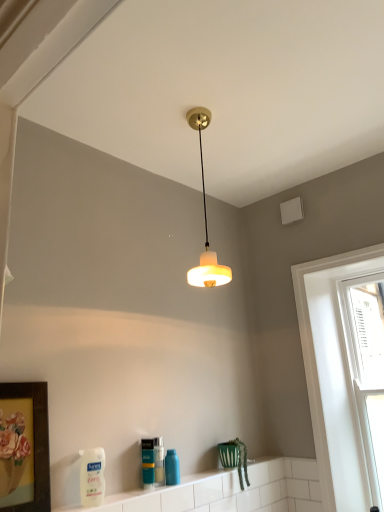
The image size is (384, 512). Identify the location of wooden framed artwork at lower left. 24,447.

Describe the element at coordinates (159, 461) in the screenshot. The width and height of the screenshot is (384, 512). I see `translucent plastic bottle at lower center` at that location.

Describe the element at coordinates (172, 468) in the screenshot. The width and height of the screenshot is (384, 512). I see `blue glossy bottle at lower center, positioned as the first cleaning product in back-to-front order` at that location.

Describe the element at coordinates (232, 490) in the screenshot. I see `white glossy tile at lower center` at that location.

At what (x,y) coordinates should I click in order to perform the action: click on white glossy tile at lower center. Please return your answer as a coordinate pair (x, y). The image size is (384, 512). Looking at the image, I should click on (232, 490).

Identify the location of white matte bottle at lower left, arranged as the first cleaning product when viewed from the left. The height and width of the screenshot is (512, 384). (92, 476).

Does wooden framed artwork at lower left turn towards white matte bottle at lower left, arranged as the first cleaning product when viewed from the left?

No, wooden framed artwork at lower left is not oriented towards white matte bottle at lower left, arranged as the first cleaning product when viewed from the left.

Where is `picture frame that appears in front of the white matte bottle at lower left, arranged as the first cleaning product when viewed from the left`? This screenshot has width=384, height=512. picture frame that appears in front of the white matte bottle at lower left, arranged as the first cleaning product when viewed from the left is located at coordinates (24, 447).

Does wooden framed artwork at lower left have a lesser width compared to white matte bottle at lower left, acting as the 2th cleaning product starting from the right?

Incorrect, the width of wooden framed artwork at lower left is not less than that of white matte bottle at lower left, acting as the 2th cleaning product starting from the right.

Would you say wooden framed artwork at lower left is a long distance from white matte bottle at lower left, arranged as the second cleaning product when viewed from the back?

wooden framed artwork at lower left is actually quite close to white matte bottle at lower left, arranged as the second cleaning product when viewed from the back.

Looking at this image, which object is closer to the camera taking this photo, white glossy tile at lower center or white glass window at right, the 1th window from the right?

white glossy tile at lower center is in front.

Between white glossy tile at lower center and white glass window at right, the 2th window from the left, which one has larger width?

white glossy tile at lower center.

Measure the distance from white glossy tile at lower center to white glass window at right, the 2th window from the left.

They are 29.18 inches apart.

Considering the sizes of white glossy tile at lower center and white glass window at right, the 1th window from the right, in the image, is white glossy tile at lower center taller or shorter than white glass window at right, the 1th window from the right,?

white glossy tile at lower center is shorter than white glass window at right, the 1th window from the right.

Considering the relative sizes of white glossy tile at lower center and white matte bottle at lower left, arranged as the second cleaning product when viewed from the back, in the image provided, is white glossy tile at lower center taller than white matte bottle at lower left, arranged as the second cleaning product when viewed from the back,?

Incorrect, the height of white glossy tile at lower center is not larger of that of white matte bottle at lower left, arranged as the second cleaning product when viewed from the back.

Is white matte bottle at lower left, which appears as the first cleaning product when viewed from the front, located within white glossy tile at lower center?

No, white matte bottle at lower left, which appears as the first cleaning product when viewed from the front, is not inside white glossy tile at lower center.

Which object is thinner, white glossy tile at lower center or white matte bottle at lower left, which appears as the first cleaning product when viewed from the front?

white matte bottle at lower left, which appears as the first cleaning product when viewed from the front.

Find the location of a particular element. Image resolution: width=384 pixels, height=512 pixels. toiletry on the left of the white glossy tile at lower center is located at coordinates (159, 461).

Is translucent plastic bottle at lower center bigger than white glossy tile at lower center?

No.

Would you say translucent plastic bottle at lower center is to the left or to the right of white glossy tile at lower center in the picture?

translucent plastic bottle at lower center is positioned on white glossy tile at lower center's left side.

Consider the image. Is translucent plastic bottle at lower center turned away from white glossy tile at lower center?

No, translucent plastic bottle at lower center's orientation is not away from white glossy tile at lower center.

Is wooden framed artwork at lower left taller or shorter than white glossy tile at lower center?

Considering their sizes, wooden framed artwork at lower left has more height than white glossy tile at lower center.

How many degrees apart are the facing directions of wooden framed artwork at lower left and white glossy tile at lower center?

wooden framed artwork at lower left and white glossy tile at lower center are facing 0.58 degrees away from each other.

Identify the location of picture frame on the left of white glossy tile at lower center. This screenshot has width=384, height=512. (24, 447).

Can you confirm if wooden framed artwork at lower left is positioned to the left of white glossy tile at lower center?

Yes, wooden framed artwork at lower left is to the left of white glossy tile at lower center.

Is white glossy window at right, the 1th window from the left, smaller than wooden framed artwork at lower left?

No, white glossy window at right, the 1th window from the left, is not smaller than wooden framed artwork at lower left.

Between white glossy window at right, the 1th window from the left, and wooden framed artwork at lower left, which one appears on the left side from the viewer's perspective?

From the viewer's perspective, wooden framed artwork at lower left appears more on the left side.

The width and height of the screenshot is (384, 512). In the image, there is a white glossy window at right, the 1th window from the left. In order to click on picture frame below it (from the image's perspective) in this screenshot , I will do `click(24, 447)`.

In the scene shown: Who is shorter, white glossy window at right, the 1th window from the left, or wooden framed artwork at lower left?

wooden framed artwork at lower left.

From the image's perspective, which one is positioned higher, white glossy window at right, the 2th window from the right, or translucent glass lampshade at upper center?

From the image's view, translucent glass lampshade at upper center is above.

Is white glossy window at right, the 2th window from the right, further to the viewer compared to translucent glass lampshade at upper center?

Yes.

Considering the sizes of white glossy window at right, the 1th window from the left, and translucent glass lampshade at upper center in the image, is white glossy window at right, the 1th window from the left, bigger or smaller than translucent glass lampshade at upper center?

white glossy window at right, the 1th window from the left, is bigger than translucent glass lampshade at upper center.

Could you tell me if white glossy window at right, the 1th window from the left, is facing translucent glass lampshade at upper center?

Yes, white glossy window at right, the 1th window from the left, is turned towards translucent glass lampshade at upper center.

You are a GUI agent. You are given a task and a screenshot of the screen. Output one action in this format:
    pyautogui.click(x=<x>, y=<y>)
    Task: Click on the picture frame above the white matte bottle at lower left, acting as the 2th cleaning product starting from the right (from the image's perspective)
    This screenshot has width=384, height=512.
    Given the screenshot: What is the action you would take?
    pyautogui.click(x=24, y=447)

This screenshot has height=512, width=384. I want to click on the 1st window positioned above the white glossy tile at lower center (from a real-world perspective), so click(x=366, y=368).

Considering their positions, is translucent plastic bottle at lower center positioned further to blue glossy bottle at lower center, the 2th cleaning product from the front, than white glass window at right, the 2th window from the left?

white glass window at right, the 2th window from the left, lies further to blue glossy bottle at lower center, the 2th cleaning product from the front, than the other object.

When comparing their distances from wooden framed artwork at lower left, does white glossy window at right, the 1th window from the left, or translucent plastic bottle at lower center seem further?

Based on the image, white glossy window at right, the 1th window from the left, appears to be further to wooden framed artwork at lower left.

From the image, which object appears to be farther from translucent glass lampshade at upper center, wooden framed artwork at lower left or white glossy tile at lower center?

Based on the image, white glossy tile at lower center appears to be further to translucent glass lampshade at upper center.

Which object lies nearer to the anchor point white glossy window at right, the 1th window from the left, translucent plastic bottle at lower center or blue glossy bottle at lower center, which is the second cleaning product from left to right?

blue glossy bottle at lower center, which is the second cleaning product from left to right, is closer to white glossy window at right, the 1th window from the left.

Estimate the real-world distances between objects in this image. Which object is further from white glossy window at right, the 1th window from the left, white matte bottle at lower left, which appears as the first cleaning product when viewed from the front, or blue glossy bottle at lower center, the 2th cleaning product from the front?

white matte bottle at lower left, which appears as the first cleaning product when viewed from the front, lies further to white glossy window at right, the 1th window from the left, than the other object.

Which object lies further to the anchor point white matte bottle at lower left, acting as the 2th cleaning product starting from the right, blue glossy bottle at lower center, which is the second cleaning product from left to right, or white glossy tile at lower center?

white glossy tile at lower center is further to white matte bottle at lower left, acting as the 2th cleaning product starting from the right.

Based on their spatial positions, is white matte bottle at lower left, arranged as the first cleaning product when viewed from the left, or white glass window at right, the 1th window from the right, closer to wooden framed artwork at lower left?

white matte bottle at lower left, arranged as the first cleaning product when viewed from the left.

Considering their positions, is white glossy window at right, the 1th window from the left, positioned closer to blue glossy bottle at lower center, which is the second cleaning product from left to right, than white glass window at right, the 1th window from the right?

white glossy window at right, the 1th window from the left.

In order to click on cleaning product between translucent glass lampshade at upper center and blue glossy bottle at lower center, placed as the first cleaning product when sorted from right to left, vertically in this screenshot , I will do `click(92, 476)`.

Find the location of `cleaning product between white glossy tile at lower center and translucent plastic bottle at lower center along the z-axis`. cleaning product between white glossy tile at lower center and translucent plastic bottle at lower center along the z-axis is located at coordinates (92, 476).

Identify the location of window sill situated between white matte bottle at lower left, arranged as the first cleaning product when viewed from the left, and white glass window at right, the 1th window from the right, from left to right. This screenshot has width=384, height=512. (232, 490).

Image resolution: width=384 pixels, height=512 pixels. Find the location of `window sill located between translucent plastic bottle at lower center and white glass window at right, the 2th window from the left, in the left-right direction`. window sill located between translucent plastic bottle at lower center and white glass window at right, the 2th window from the left, in the left-right direction is located at coordinates (232, 490).